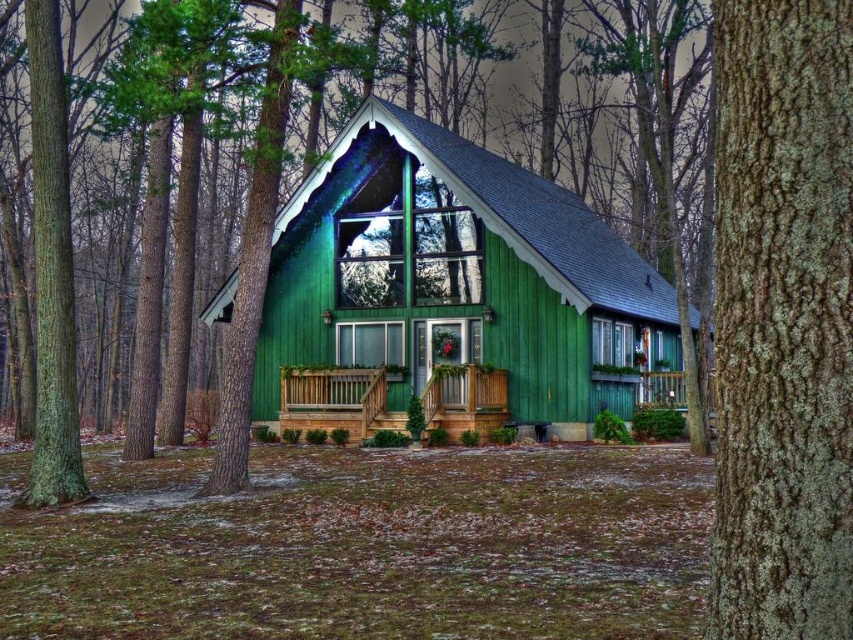
Question: Which point appears farthest from the camera in this image?

Choices:
 (A) (260, 388)
 (B) (842, 609)
 (C) (577, 300)
 (D) (372, 419)

Answer: (A)

Question: Is green lichen-covered tree trunk at right further to camera compared to wooden porch at center?

Choices:
 (A) no
 (B) yes

Answer: (A)

Question: Based on their relative distances, which object is nearer to the green wood cabin at center?

Choices:
 (A) green lichen-covered tree trunk at right
 (B) green rough bark tree at center

Answer: (B)

Question: Among these points, which one is farthest from the camera?

Choices:
 (A) (376, 403)
 (B) (370, 360)
 (C) (326, 344)

Answer: (C)

Question: Does green rough bark tree at center appear on the right side of green wood cabin at center?

Choices:
 (A) no
 (B) yes

Answer: (A)

Question: Does green rough bark tree at center have a lesser width compared to wooden porch at center?

Choices:
 (A) no
 (B) yes

Answer: (A)